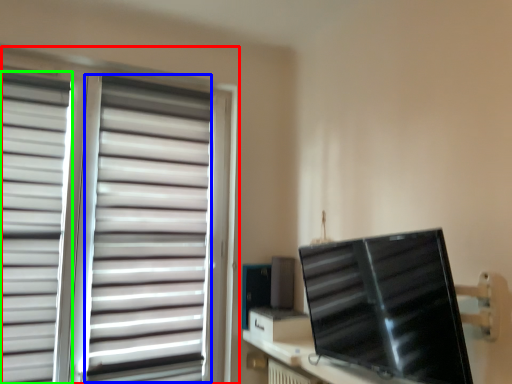
Question: Which is farther away from window blind (highlighted by a red box)? curtain (highlighted by a blue box) or curtain (highlighted by a green box)?

Choices:
 (A) curtain
 (B) curtain

Answer: (B)